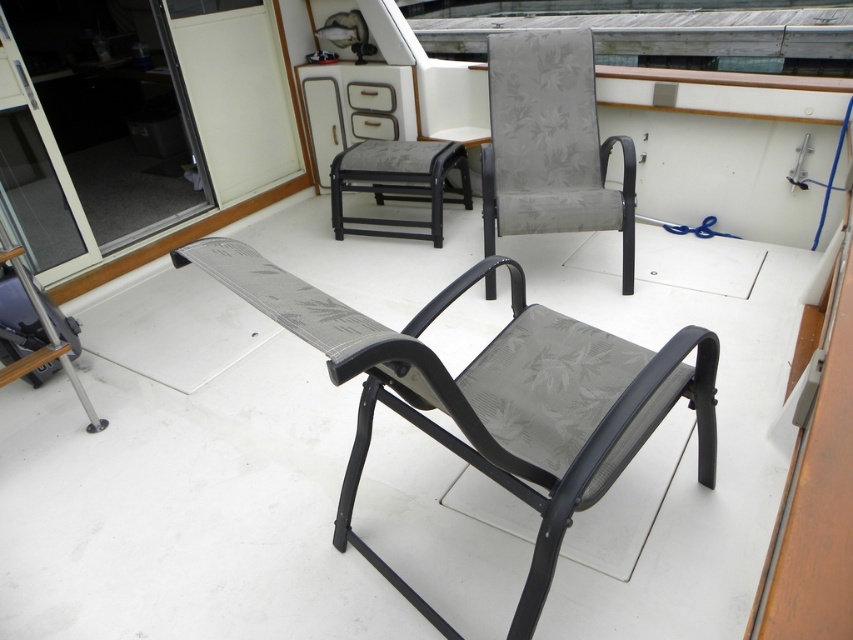
From the picture: You are standing inside a boat and want to place a small item on the closest point between point [518,228] and point [334,186]. Which point should you choose?

Point [518,228] is closer to the camera than point [334,186], so you should choose point [518,228] to place the item.

You are a guest sitting in the gray fabric chair at upper center and want to reach the gray fabric stool at center to grab a drink. Can you easily step over the space between them?

The gray fabric chair at upper center is in front of the gray fabric stool at center, meaning the chair is closer to you. To reach the stool, you would need to move around the chair since it is blocking the direct path to the stool.